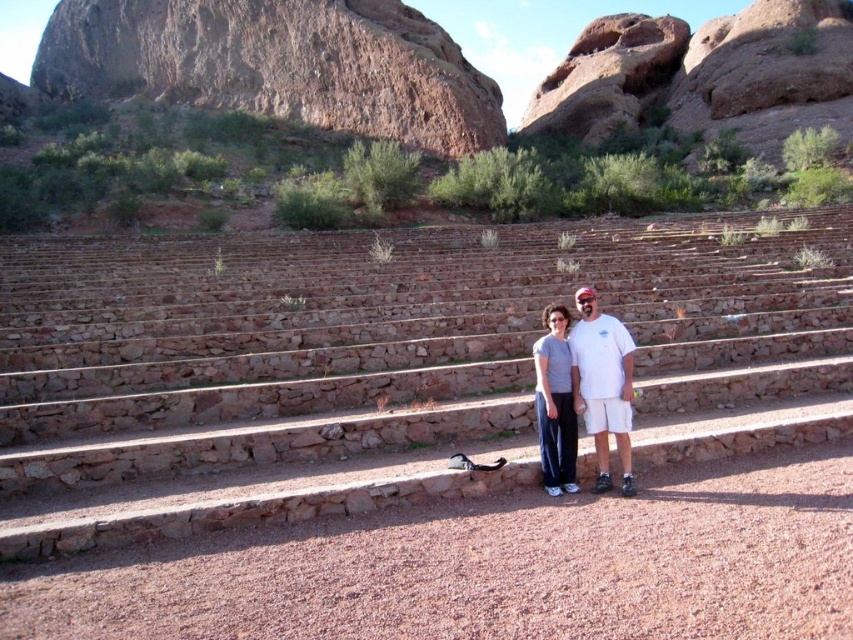
You are standing on the stone steps in the desert scene. There are two points marked on the steps. The first point is at coordinates point [801,344] and the second point is at point [558,324]. If you want to walk from the first point to the second point, which direction should you move relative to the steps?

Point [801,344] is behind point [558,324]. To move from the first point to the second point, you should move forward towards the front of the steps.

You are standing on the brown stone stairs at center and want to move to the matte gray pants at center. Which direction should you move to reach them?

The brown stone stairs at center is to the left of matte gray pants at center, so you should move to the right to reach them.